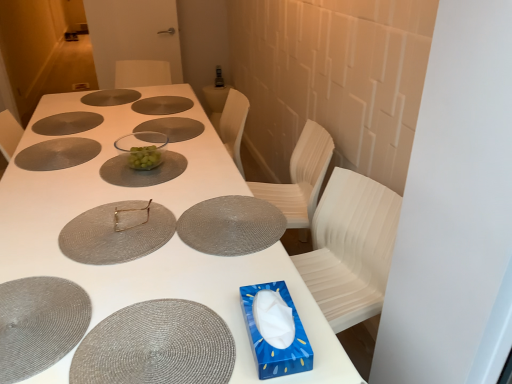
This screenshot has width=512, height=384. I want to click on free location above matte gray placemat at lower center, the ninth glass plate from the back (from a real-world perspective), so click(159, 337).